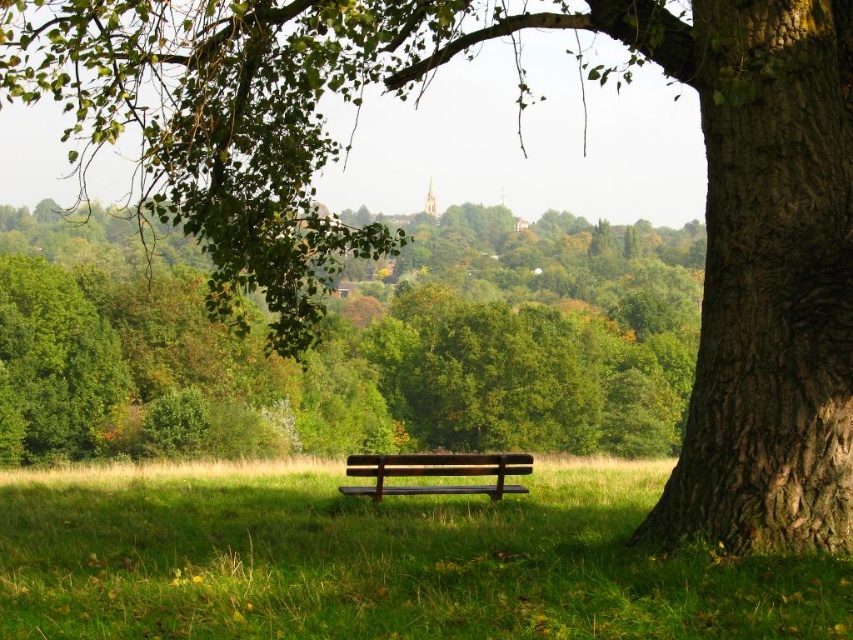
You are standing in the outdoor scene and want to place a small flag at each of the two points labeled point (444, 404) and point (374, 456). Which point is closer to you when you are facing the scene?

Point (444, 404) is further to the camera than point (374, 456), so the point closer to you is point (374, 456).